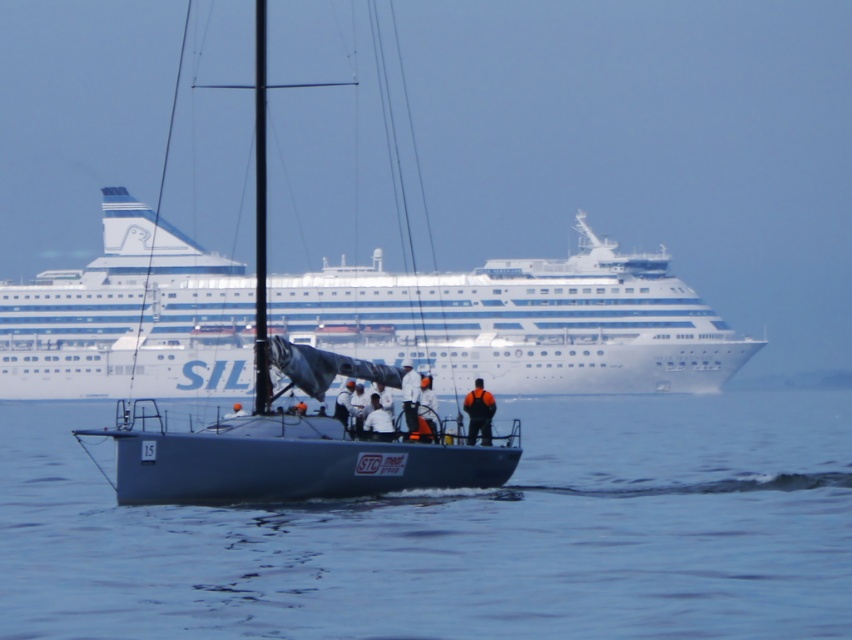
Question: Which is nearer to the white fabric shirt at center?

Choices:
 (A) blue water at center
 (B) white glossy cruise ship at upper center
 (C) orange fleece jacket at center

Answer: (C)

Question: Observing the image, what is the correct spatial positioning of blue water at center in reference to white fabric shirt at center?

Choices:
 (A) left
 (B) right

Answer: (A)

Question: Which object is positioned farthest from the metallic gray sailboat at center?

Choices:
 (A) white fabric at center
 (B) orange fleece jacket at center
 (C) white glossy cruise ship at upper center
 (D) blue water at center

Answer: (B)

Question: Does white glossy cruise ship at upper center have a lesser width compared to white fabric at center?

Choices:
 (A) yes
 (B) no

Answer: (B)

Question: Which point is closer to the camera?

Choices:
 (A) orange fleece jacket at center
 (B) white matte jacket at center

Answer: (B)

Question: Is white matte jacket at center to the left of white fabric at center from the viewer's perspective?

Choices:
 (A) no
 (B) yes

Answer: (B)